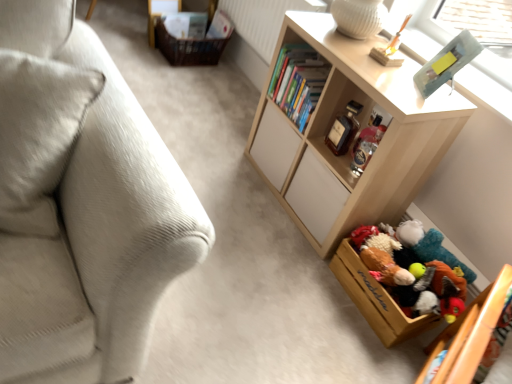
The width and height of the screenshot is (512, 384). Describe the element at coordinates (81, 205) in the screenshot. I see `light beige fabric couch at left` at that location.

Image resolution: width=512 pixels, height=384 pixels. What do you see at coordinates (264, 20) in the screenshot? I see `white textured radiator at upper center` at bounding box center [264, 20].

What do you see at coordinates (376, 299) in the screenshot? The height and width of the screenshot is (384, 512). I see `wooden toy box at lower right, arranged as the 2th storage box when viewed from the back` at bounding box center [376, 299].

The image size is (512, 384). Describe the element at coordinates (188, 48) in the screenshot. I see `brown woven basket at upper left, the 1th storage box when ordered from top to bottom` at that location.

The height and width of the screenshot is (384, 512). What are the coordinates of `metallic gray frame at upper right` in the screenshot? It's located at (423, 19).

Does point (433, 38) come in front of point (387, 321)?

No, it is not.

Looking at their sizes, would you say metallic gray frame at upper right is wider or thinner than wooden toy box at lower right, marked as the second storage box in a top-to-bottom arrangement?

metallic gray frame at upper right is thinner than wooden toy box at lower right, marked as the second storage box in a top-to-bottom arrangement.

From the picture: Would you consider metallic gray frame at upper right to be distant from wooden toy box at lower right, arranged as the 2th storage box when viewed from the back?

Absolutely, metallic gray frame at upper right is distant from wooden toy box at lower right, arranged as the 2th storage box when viewed from the back.

Is metallic gray frame at upper right oriented towards wooden toy box at lower right, marked as the second storage box in a top-to-bottom arrangement?

No.

Are wooden toy box at lower right, which appears as the 1th storage box when ordered from the bottom, and light wood shelf at center located far from each other?

No, wooden toy box at lower right, which appears as the 1th storage box when ordered from the bottom, is in close proximity to light wood shelf at center.

Based on their sizes in the image, would you say wooden toy box at lower right, placed as the 2th storage box when sorted from left to right, is bigger or smaller than light wood shelf at center?

wooden toy box at lower right, placed as the 2th storage box when sorted from left to right, is smaller than light wood shelf at center.

Is wooden toy box at lower right, arranged as the 1th storage box when viewed from the front, closer to the viewer compared to light wood shelf at center?

No, wooden toy box at lower right, arranged as the 1th storage box when viewed from the front, is further to the viewer.

Considering the positions of objects wooden toy box at lower right, arranged as the 1th storage box when viewed from the front, and light wood shelf at center in the image provided, who is more to the left, wooden toy box at lower right, arranged as the 1th storage box when viewed from the front, or light wood shelf at center?

light wood shelf at center is more to the left.

Could you tell me if metallic gray frame at upper right is facing brown woven basket at upper left, the second storage box from the right?

No, metallic gray frame at upper right does not turn towards brown woven basket at upper left, the second storage box from the right.

Is metallic gray frame at upper right taller than brown woven basket at upper left, the 1th storage box when ordered from top to bottom?

Yes, metallic gray frame at upper right is taller than brown woven basket at upper left, the 1th storage box when ordered from top to bottom.

Find the location of `window frame below the brown woven basket at upper left, the 1th storage box from the back (from the image's perspective)`. window frame below the brown woven basket at upper left, the 1th storage box from the back (from the image's perspective) is located at coordinates (423, 19).

Locate an element on the screen. storage box above the wooden toy box at lower right, arranged as the 1th storage box when viewed from the front (from a real-world perspective) is located at coordinates (188, 48).

How far apart are wooden toy box at lower right, arranged as the 2th storage box when viewed from the back, and brown woven basket at upper left, the 1th storage box when ordered from top to bottom?

wooden toy box at lower right, arranged as the 2th storage box when viewed from the back, and brown woven basket at upper left, the 1th storage box when ordered from top to bottom, are 1.85 meters apart.

From the image's perspective, is wooden toy box at lower right, the first storage box viewed from the right, positioned above or below brown woven basket at upper left, the 2th storage box positioned from the front?

wooden toy box at lower right, the first storage box viewed from the right, is below brown woven basket at upper left, the 2th storage box positioned from the front.

Does wooden toy box at lower right, which appears as the 1th storage box when ordered from the bottom, have a lesser width compared to brown woven basket at upper left, the second storage box from the right?

No.

From the image's perspective, is white textured radiator at upper center on top of light beige fabric couch at left?

Correct, white textured radiator at upper center appears higher than light beige fabric couch at left in the image.

Is white textured radiator at upper center shorter than light beige fabric couch at left?

Yes.

Which point is more forward, (256,4) or (123,117)?

The point (123,117) is in front.

In the scene shown: Based on their sizes in the image, would you say white textured radiator at upper center is bigger or smaller than metallic gray frame at upper right?

In the image, white textured radiator at upper center appears to be larger than metallic gray frame at upper right.

Is white textured radiator at upper center facing away from metallic gray frame at upper right?

No, white textured radiator at upper center's orientation is not away from metallic gray frame at upper right.

Is point (236, 29) closer or farther from the camera than point (431, 27)?

Point (236, 29) appears to be farther away from the viewer than point (431, 27).

Consider the image. Considering the relative sizes of white textured radiator at upper center and metallic gray frame at upper right in the image provided, is white textured radiator at upper center thinner than metallic gray frame at upper right?

Correct, the width of white textured radiator at upper center is less than that of metallic gray frame at upper right.

From a real-world perspective, starting from the white textured radiator at upper center, which storage box is the 1st one below it? Please provide its 2D coordinates.

[(188, 48)]

Which point is more distant from viewer, (x=246, y=37) or (x=228, y=38)?

The point (x=228, y=38) is farther from the camera.

Is white textured radiator at upper center placed right next to brown woven basket at upper left, the 1th storage box from the back?

white textured radiator at upper center and brown woven basket at upper left, the 1th storage box from the back, are clearly separated.

From a real-world perspective, which is physically below, white textured radiator at upper center or brown woven basket at upper left, acting as the second storage box starting from the bottom?

brown woven basket at upper left, acting as the second storage box starting from the bottom.

This screenshot has width=512, height=384. I want to click on window frame above the wooden toy box at lower right, placed as the 2th storage box when sorted from left to right (from a real-world perspective), so click(423, 19).

Find the location of `storage box that is the 1st one when counting backward from the light wood shelf at center`. storage box that is the 1st one when counting backward from the light wood shelf at center is located at coordinates (376, 299).

Which object lies nearer to the anchor point light wood shelf at center, brown woven basket at upper left, the first storage box in the left-to-right sequence, or light beige fabric couch at left?

Based on the image, light beige fabric couch at left appears to be nearer to light wood shelf at center.

Looking at the image, which one is located further to light beige fabric couch at left, white textured radiator at upper center or metallic gray frame at upper right?

metallic gray frame at upper right is positioned further to the anchor light beige fabric couch at left.

Which object lies nearer to the anchor point light beige fabric couch at left, brown woven basket at upper left, the 1th storage box when ordered from top to bottom, or white textured radiator at upper center?

white textured radiator at upper center lies closer to light beige fabric couch at left than the other object.

Considering their positions, is light beige fabric couch at left positioned further to metallic gray frame at upper right than white textured radiator at upper center?

The object further to metallic gray frame at upper right is light beige fabric couch at left.

Considering their positions, is metallic gray frame at upper right positioned further to white textured radiator at upper center than brown woven basket at upper left, the second storage box from the right?

metallic gray frame at upper right is positioned further to the anchor white textured radiator at upper center.

Based on the photo, estimate the real-world distances between objects in this image. Which object is further from brown woven basket at upper left, the second storage box from the right, metallic gray frame at upper right or light beige fabric couch at left?

The object further to brown woven basket at upper left, the second storage box from the right, is light beige fabric couch at left.

Considering their positions, is white textured radiator at upper center positioned closer to brown woven basket at upper left, acting as the second storage box starting from the bottom, than metallic gray frame at upper right?

white textured radiator at upper center lies closer to brown woven basket at upper left, acting as the second storage box starting from the bottom, than the other object.

Based on their spatial positions, is light wood shelf at center or brown woven basket at upper left, acting as the second storage box starting from the bottom, closer to metallic gray frame at upper right?

The object closer to metallic gray frame at upper right is light wood shelf at center.

Identify the location of shelf between light beige fabric couch at left and metallic gray frame at upper right in the horizontal direction. (361, 124).

In order to click on shelf between light beige fabric couch at left and wooden toy box at lower right, arranged as the 1th storage box when viewed from the front, in the horizontal direction in this screenshot , I will do `click(361, 124)`.

Image resolution: width=512 pixels, height=384 pixels. Find the location of `storage box between white textured radiator at upper center and wooden toy box at lower right, marked as the second storage box in a top-to-bottom arrangement, vertically`. storage box between white textured radiator at upper center and wooden toy box at lower right, marked as the second storage box in a top-to-bottom arrangement, vertically is located at coordinates (188, 48).

Locate an element on the screen. The height and width of the screenshot is (384, 512). storage box between light beige fabric couch at left and brown woven basket at upper left, the 1th storage box when ordered from top to bottom, in the front-back direction is located at coordinates (376, 299).